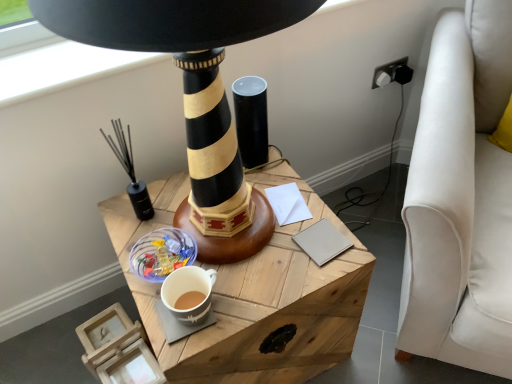
Identify the location of free spot above wooden table at center (from a real-world perspective). (231, 247).